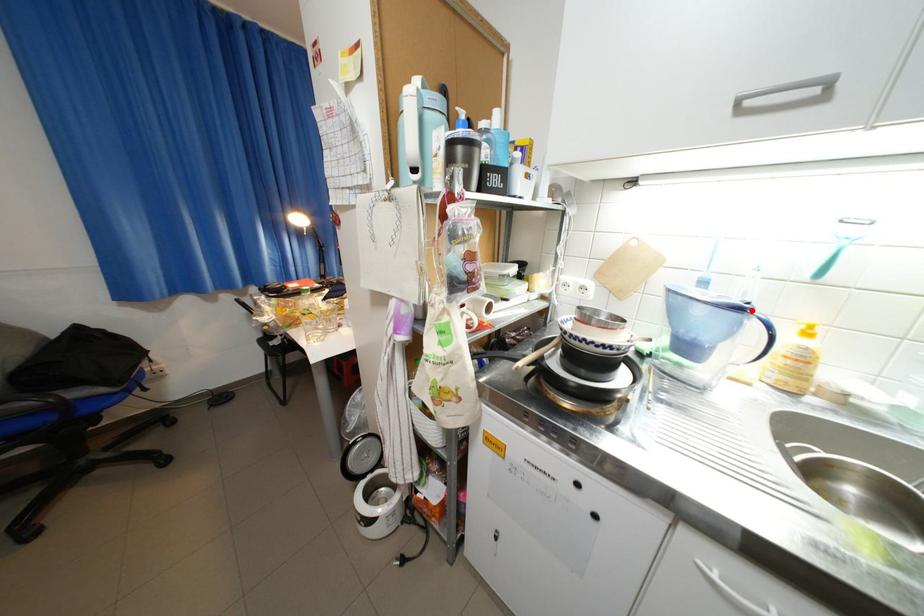
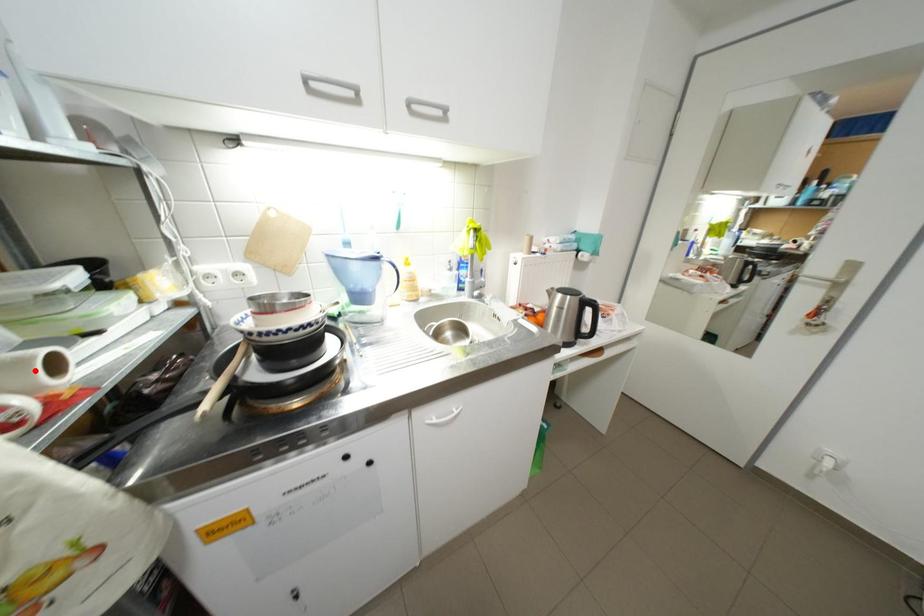
I am providing you with two images of the same scene from different viewpoints. A red point is marked on the first image and another point is marked on the second image. Is the red point in image1 aligned with the point shown in image2?

No